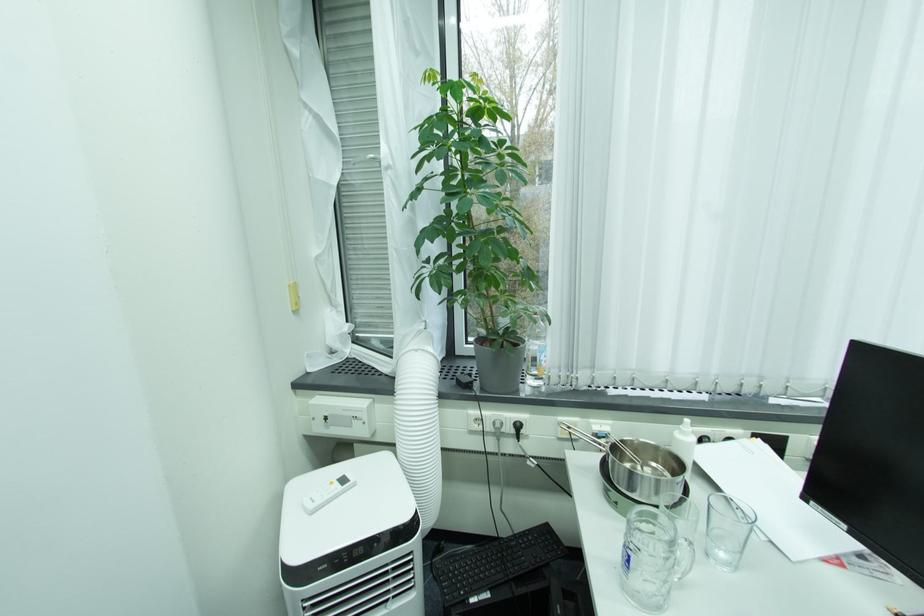
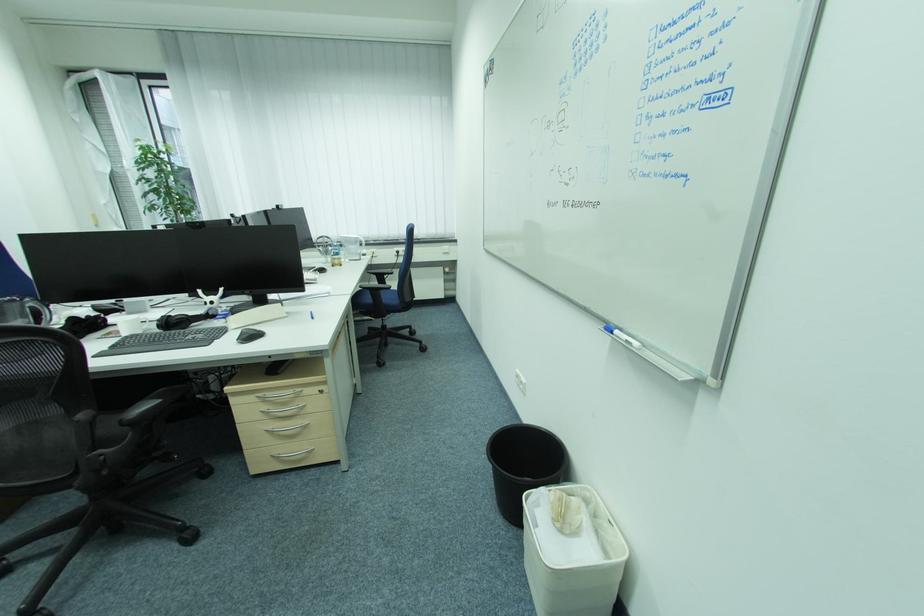
What movement of the cameraman would produce the second image?

The cameraman moved toward right, backward.